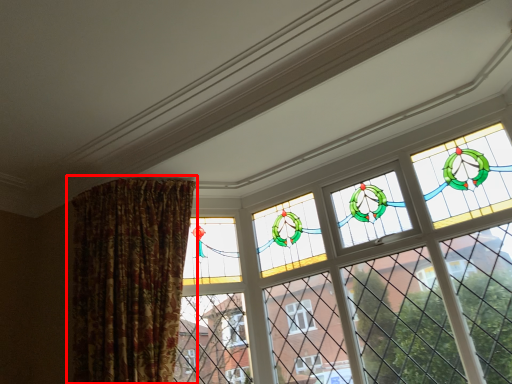
Question: Observing the image, what is the correct spatial positioning of curtain (annotated by the red box) in reference to window?

Choices:
 (A) left
 (B) right

Answer: (A)